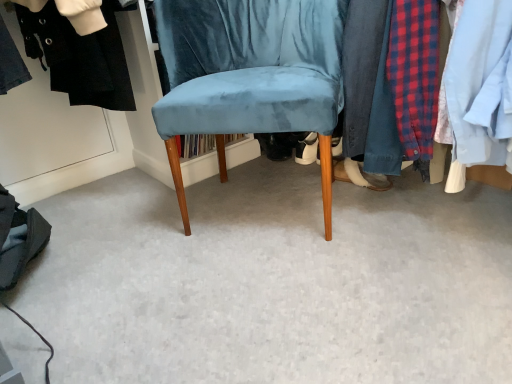
Where is `vacant space in front of velvet blue chair at center`? This screenshot has height=384, width=512. vacant space in front of velvet blue chair at center is located at coordinates (287, 301).